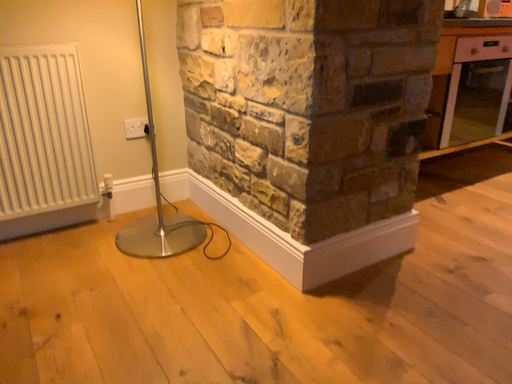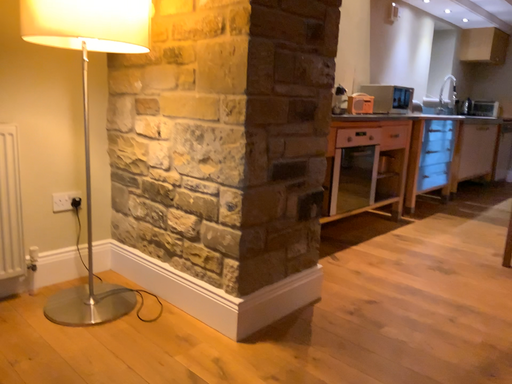
Question: How did the camera likely rotate when shooting the video?

Choices:
 (A) rotated upward
 (B) rotated downward

Answer: (A)